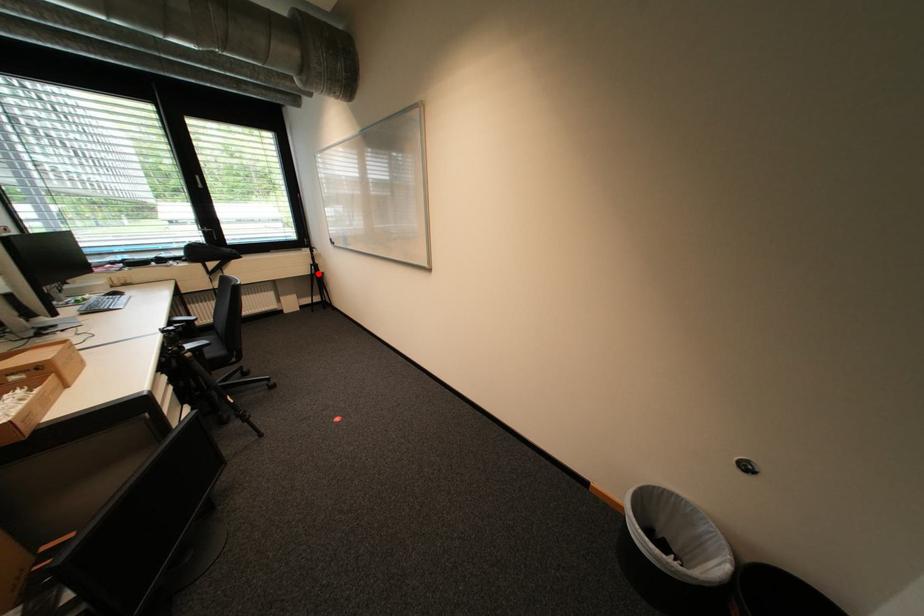
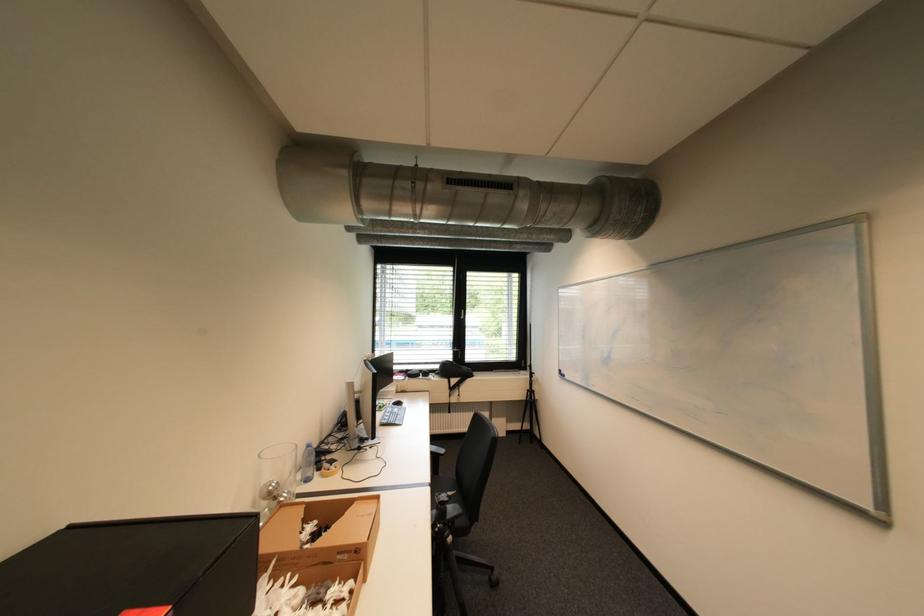
The point at the highlighted location is marked in the first image. Where is the corresponding point in the second image?

(532, 400)